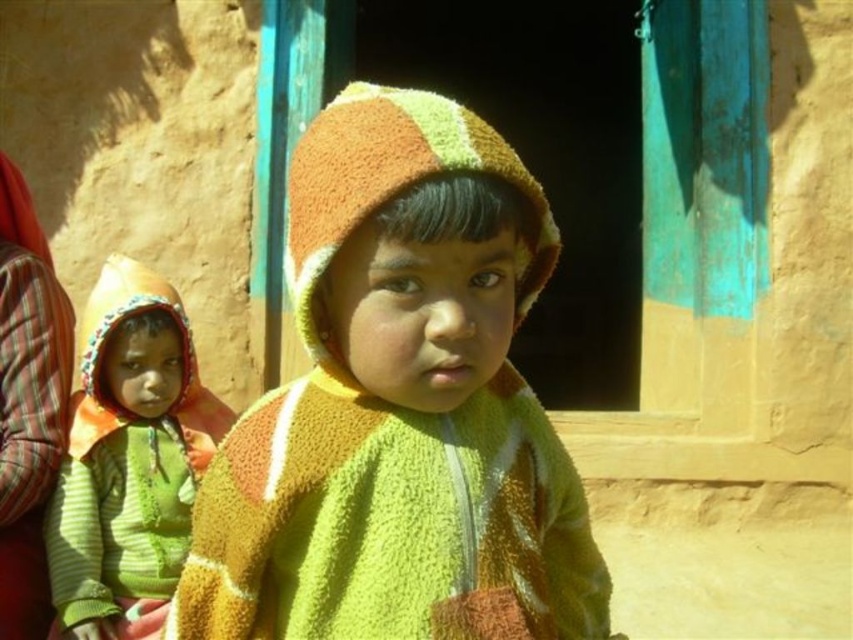
You are trying to decide which jacket to wear for a chilly day. You see the fluffy fleece jacket at center and the green striped sweater at left in the image. Which one would you choose if you want the larger one?

The green striped sweater at left is larger than the fluffy fleece jacket at center, so you should choose the green striped sweater at left.

You are standing at the origin point of the image. There is a point at coordinates (129, 452). What object is located at that point?

The point at coordinates (129, 452) corresponds to the green striped sweater at left.

Where is the fluffy fleece jacket at center located in the image?

The fluffy fleece jacket at center is located at the 2D coordinates point (x=399, y=406) in the image.